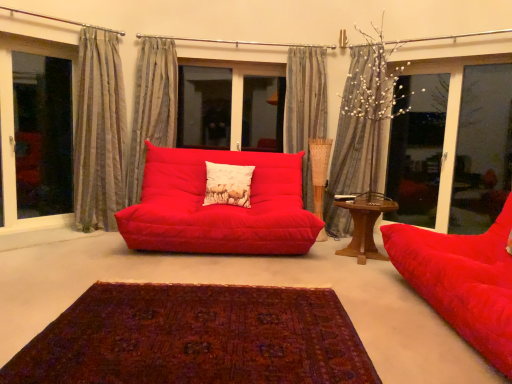
You are a GUI agent. You are given a task and a screenshot of the screen. Output one action in this format:
    pyautogui.click(x=<x>, y=<y>)
    Task: Click on the vacant area that is in front of wooden table at right
    Image resolution: width=512 pixels, height=384 pixels.
    Given the screenshot: What is the action you would take?
    pyautogui.click(x=362, y=271)